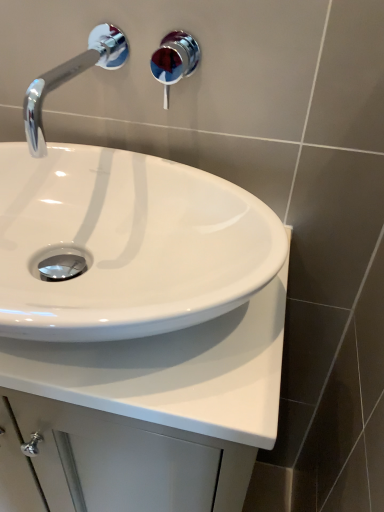
Question: Considering the relative sizes of shiny chrome shower at upper center and chrome/metallic faucet at upper left in the image provided, is shiny chrome shower at upper center taller than chrome/metallic faucet at upper left?

Choices:
 (A) yes
 (B) no

Answer: (A)

Question: Is shiny chrome shower at upper center facing towards chrome/metallic faucet at upper left?

Choices:
 (A) yes
 (B) no

Answer: (B)

Question: Is shiny chrome shower at upper center positioned far away from chrome/metallic faucet at upper left?

Choices:
 (A) yes
 (B) no

Answer: (B)

Question: From a real-world perspective, is shiny chrome shower at upper center positioned over chrome/metallic faucet at upper left based on gravity?

Choices:
 (A) no
 (B) yes

Answer: (A)

Question: Is chrome/metallic faucet at upper left completely or partially inside shiny chrome shower at upper center?

Choices:
 (A) yes
 (B) no

Answer: (B)

Question: Is shiny chrome shower at upper center to the right of chrome/metallic faucet at upper left from the viewer's perspective?

Choices:
 (A) no
 (B) yes

Answer: (B)

Question: From a real-world perspective, is white glossy countertop at center positioned over chrome/metallic faucet at upper left based on gravity?

Choices:
 (A) yes
 (B) no

Answer: (B)

Question: Can you confirm if white glossy countertop at center is shorter than chrome/metallic faucet at upper left?

Choices:
 (A) no
 (B) yes

Answer: (A)

Question: Is the position of white glossy countertop at center less distant than that of chrome/metallic faucet at upper left?

Choices:
 (A) no
 (B) yes

Answer: (B)

Question: Is white glossy countertop at center surrounding chrome/metallic faucet at upper left?

Choices:
 (A) yes
 (B) no

Answer: (B)

Question: Considering the relative sizes of white glossy countertop at center and chrome/metallic faucet at upper left in the image provided, is white glossy countertop at center smaller than chrome/metallic faucet at upper left?

Choices:
 (A) no
 (B) yes

Answer: (A)

Question: Does white glossy countertop at center have a greater width compared to chrome/metallic faucet at upper left?

Choices:
 (A) yes
 (B) no

Answer: (A)

Question: Can you see chrome/metallic faucet at upper left touching white glossy countertop at center?

Choices:
 (A) no
 (B) yes

Answer: (A)